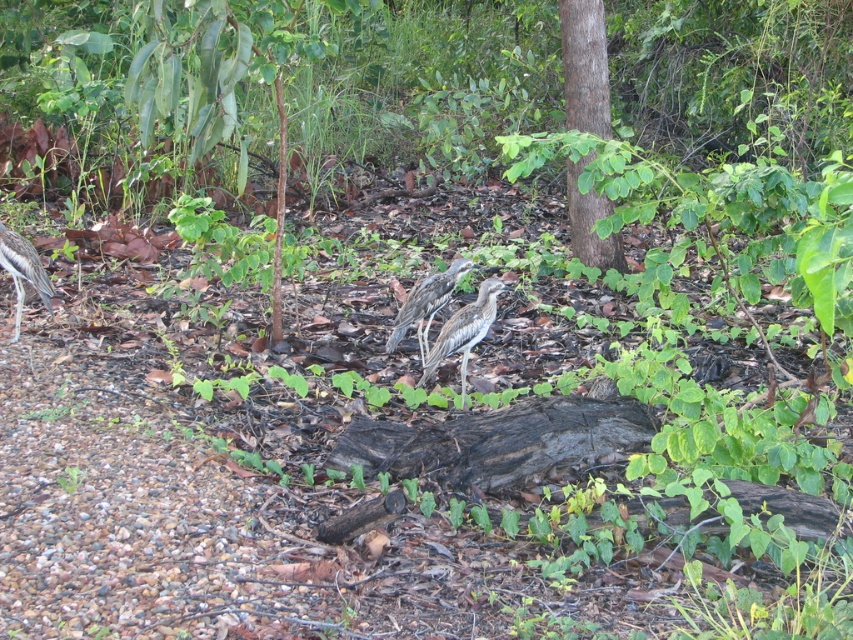
Question: Is brown speckled feathers at center positioned in front of speckled feathered bird at left?

Choices:
 (A) no
 (B) yes

Answer: (A)

Question: Which object is closer to the camera taking this photo?

Choices:
 (A) brown speckled feathers at center
 (B) speckled feathered bird at left
 (C) speckled feathered bird at center
 (D) smooth brown tree at center

Answer: (C)

Question: Estimate the real-world distances between objects in this image. Which object is closer to the speckled feathered bird at left?

Choices:
 (A) smooth brown tree at center
 (B) brown speckled feathers at center

Answer: (B)

Question: Can you confirm if brown speckled feathers at center is positioned to the left of speckled feathered bird at left?

Choices:
 (A) no
 (B) yes

Answer: (A)

Question: Which of the following is the farthest from the observer?

Choices:
 (A) brown speckled feathers at center
 (B) speckled feathered bird at left
 (C) speckled feathered bird at center
 (D) smooth brown tree at center

Answer: (D)

Question: Does speckled feathered bird at center have a greater width compared to speckled feathered bird at left?

Choices:
 (A) no
 (B) yes

Answer: (A)